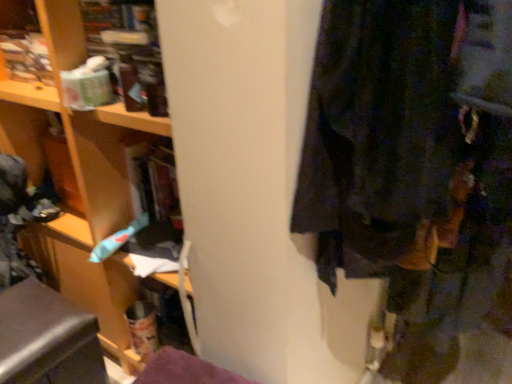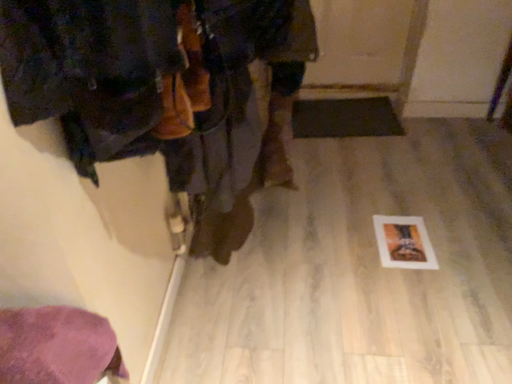
Question: Which way did the camera rotate in the video?

Choices:
 (A) rotated left
 (B) rotated right

Answer: (B)